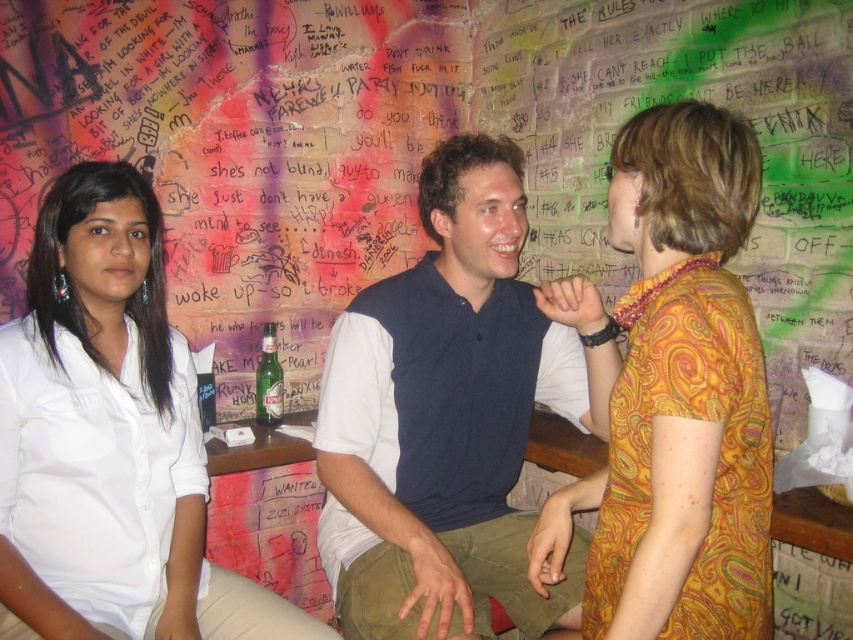
Based on the photo, is white smooth shirt at left thinner than yellow paisley dress at center?

No.

Is white smooth shirt at left in front of yellow paisley dress at center?

That is False.

Which is behind, point (161, 538) or point (698, 532)?

The point (161, 538) is behind.

Identify the location of white smooth shirt at left. The height and width of the screenshot is (640, 853). (109, 436).

Which is above, dark blue shirt at center or yellow paisley dress at center?

yellow paisley dress at center is higher up.

This screenshot has height=640, width=853. What do you see at coordinates (451, 413) in the screenshot? I see `dark blue shirt at center` at bounding box center [451, 413].

Which is behind, point (343, 403) or point (614, 516)?

Point (343, 403)

You are a GUI agent. You are given a task and a screenshot of the screen. Output one action in this format:
    pyautogui.click(x=<x>, y=<y>)
    Task: Click on the dark blue shirt at center
    
    Given the screenshot: What is the action you would take?
    pyautogui.click(x=451, y=413)

Which is above, white smooth shirt at left or green glass beer bottle at center?

green glass beer bottle at center

Does white smooth shirt at left have a larger size compared to green glass beer bottle at center?

Indeed, white smooth shirt at left has a larger size compared to green glass beer bottle at center.

At what (x,y) coordinates should I click in order to perform the action: click on white smooth shirt at left. Please return your answer as a coordinate pair (x, y). The width and height of the screenshot is (853, 640). Looking at the image, I should click on (109, 436).